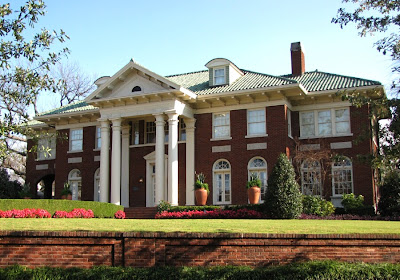
Find the location of a particular element. 1 window on third floor right side is located at coordinates (228, 76).